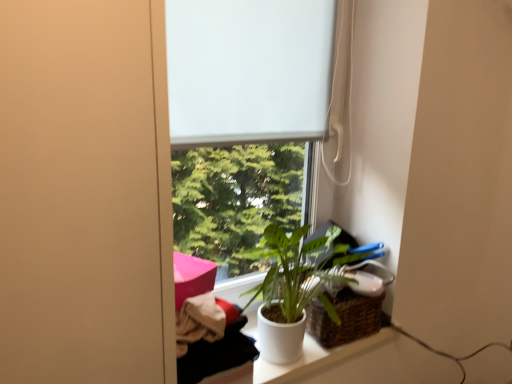
Question: Considering the relative positions of white matte window at center and white matte window screen at center in the image provided, is white matte window at center in front of white matte window screen at center?

Choices:
 (A) yes
 (B) no

Answer: (A)

Question: Does white matte window at center have a larger size compared to white matte window screen at center?

Choices:
 (A) no
 (B) yes

Answer: (B)

Question: Does white matte window at center have a greater width compared to white matte window screen at center?

Choices:
 (A) yes
 (B) no

Answer: (A)

Question: Is white matte window at center smaller than white matte window screen at center?

Choices:
 (A) no
 (B) yes

Answer: (A)

Question: Does white matte window at center lie behind white matte window screen at center?

Choices:
 (A) yes
 (B) no

Answer: (B)

Question: Visually, is woven brown basket at lower right positioned to the left or to the right of white matte window screen at center?

Choices:
 (A) right
 (B) left

Answer: (A)

Question: From a real-world perspective, is woven brown basket at lower right above or below white matte window screen at center?

Choices:
 (A) above
 (B) below

Answer: (B)

Question: From the image's perspective, is woven brown basket at lower right positioned above or below white matte window screen at center?

Choices:
 (A) below
 (B) above

Answer: (A)

Question: In terms of size, does woven brown basket at lower right appear bigger or smaller than white matte window screen at center?

Choices:
 (A) big
 (B) small

Answer: (B)

Question: Based on their sizes in the image, would you say white matte window screen at center is bigger or smaller than woven brown basket at lower right?

Choices:
 (A) small
 (B) big

Answer: (B)

Question: From a real-world perspective, is white matte window screen at center physically located above or below woven brown basket at lower right?

Choices:
 (A) below
 (B) above

Answer: (B)

Question: Is white matte window screen at center spatially inside woven brown basket at lower right, or outside of it?

Choices:
 (A) outside
 (B) inside

Answer: (A)

Question: Does point (264, 6) appear closer or farther from the camera than point (373, 263)?

Choices:
 (A) closer
 (B) farther

Answer: (A)

Question: Is white matte window at center wider or thinner than woven brown basket at lower right?

Choices:
 (A) thin
 (B) wide

Answer: (A)

Question: Is white matte window at center to the left or to the right of woven brown basket at lower right in the image?

Choices:
 (A) left
 (B) right

Answer: (A)